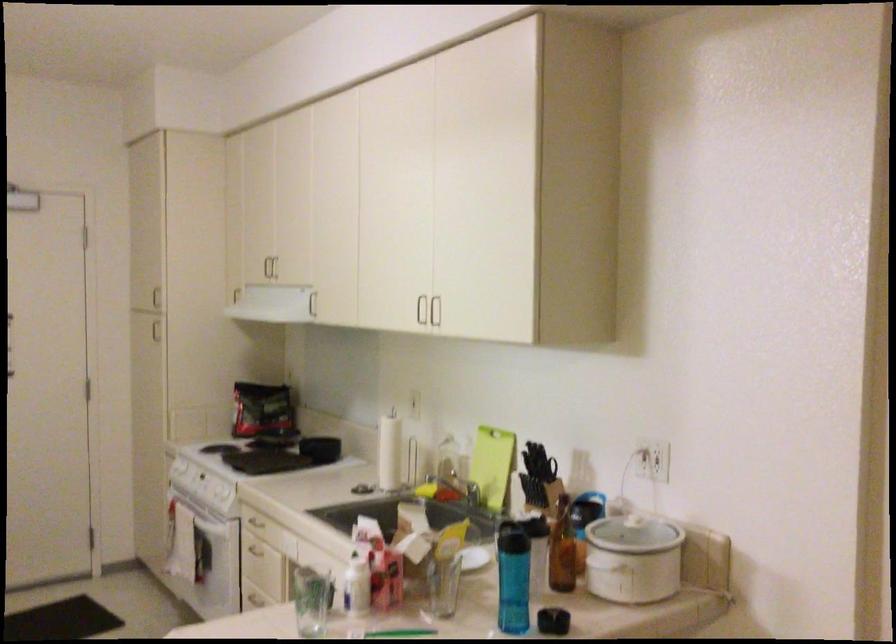
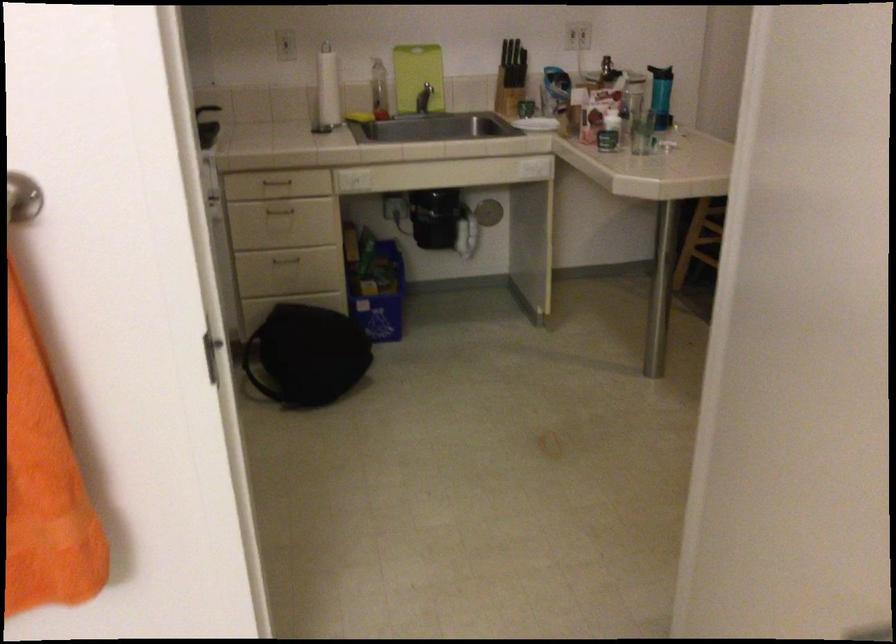
In the second image, find the point that corresponds to pixel 604 469 in the first image.

(518, 53)